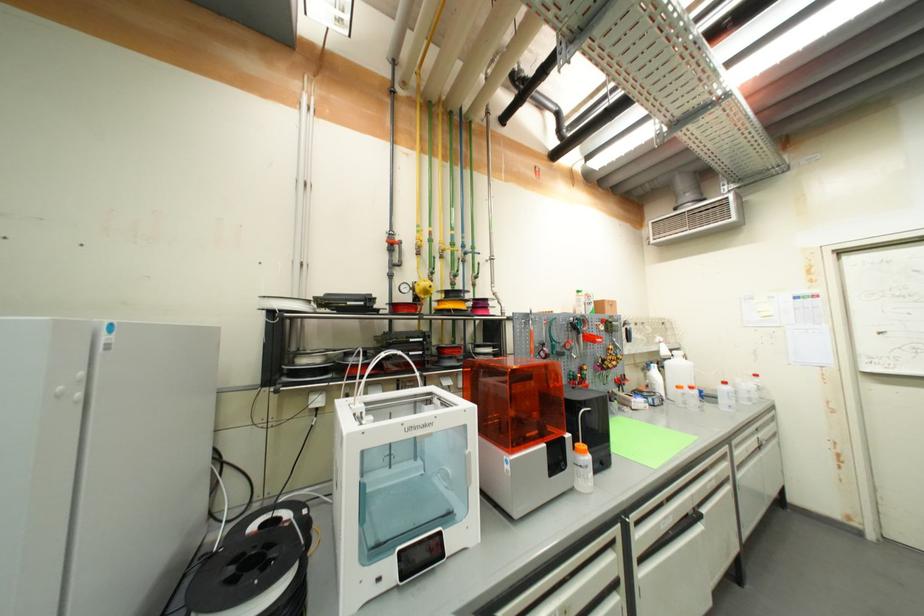
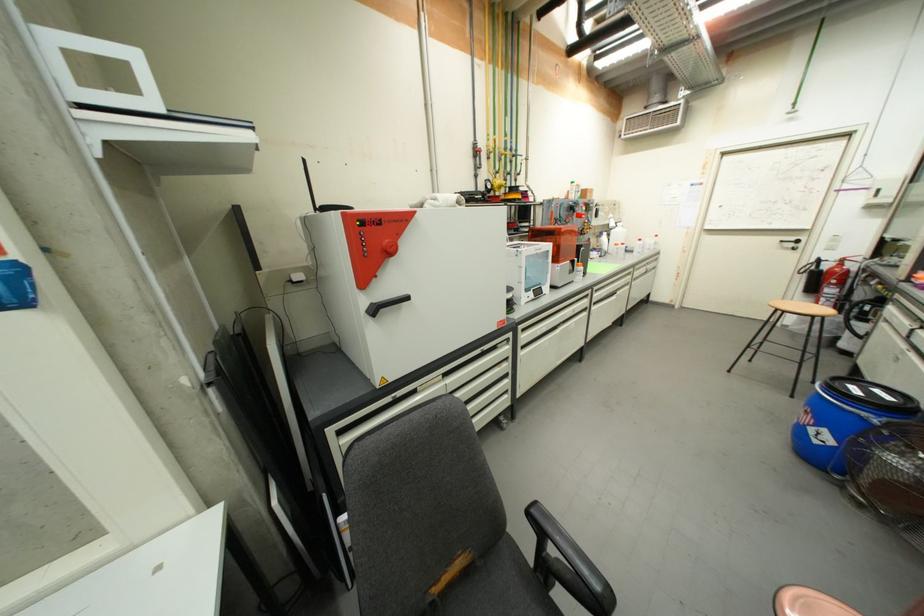
Which direction would the cameraman need to move to produce the second image?

The movement direction of the cameraman is left, backward.